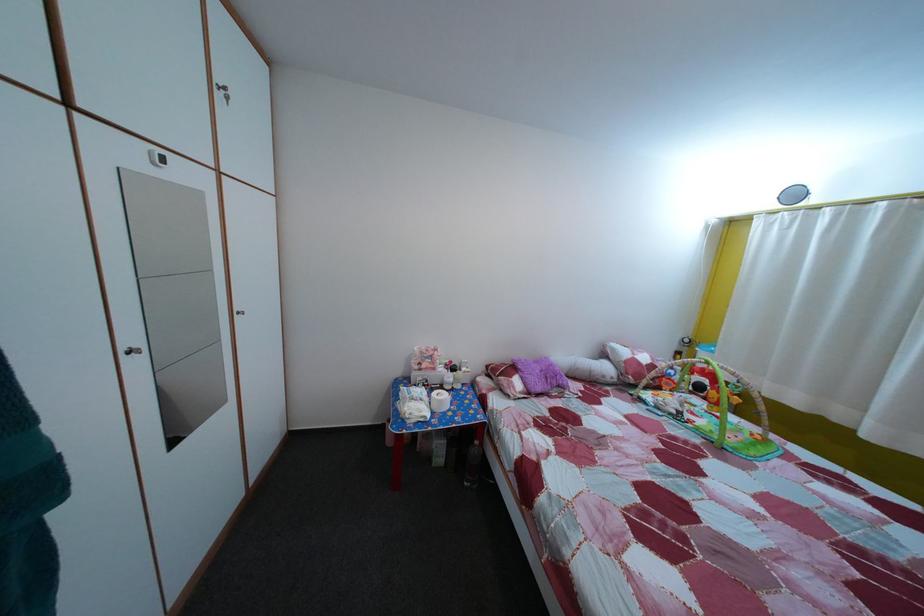
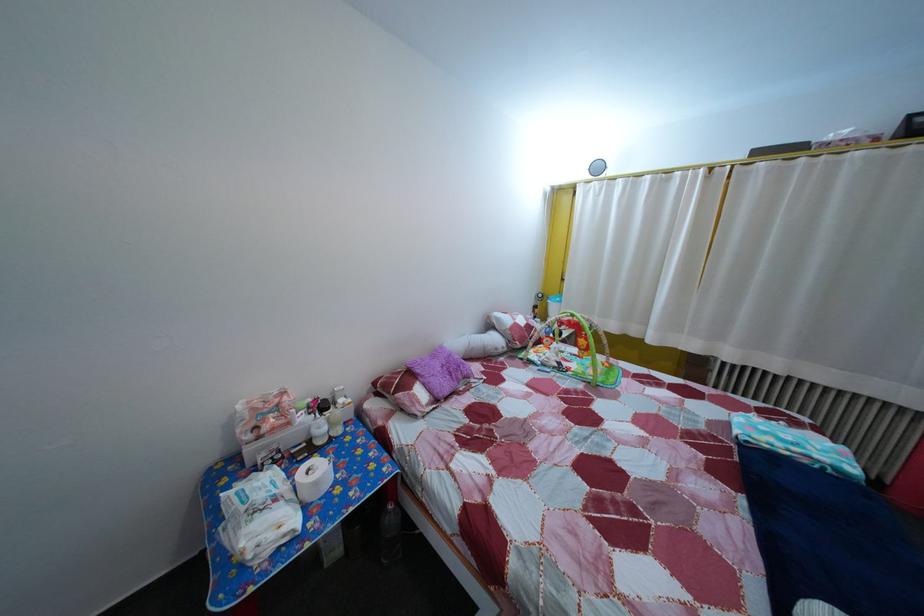
Locate, in the second image, the point that corresponds to point 450,408 in the first image.

(325, 491)